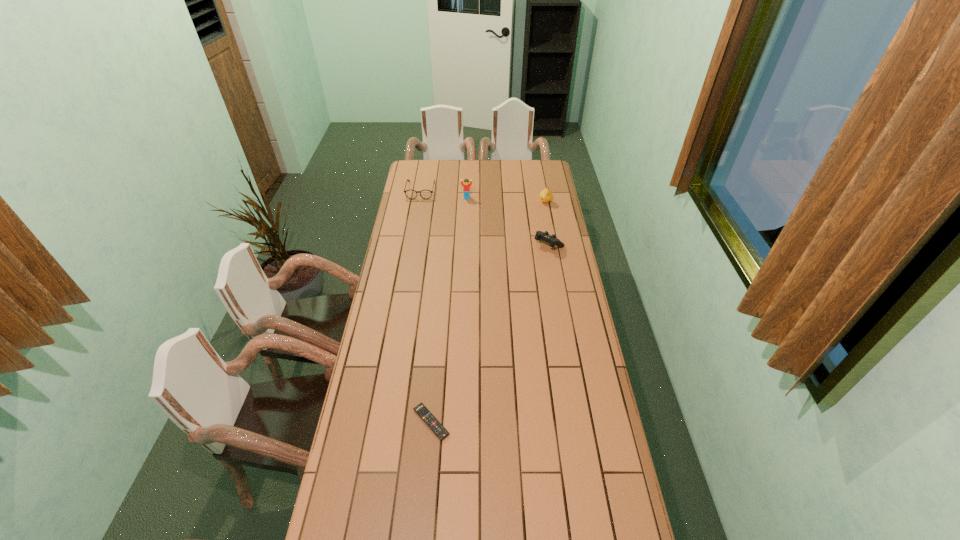
Locate an element on the screen. Lego is located at coordinates (466, 185).

Where is `pear`? pear is located at coordinates (546, 195).

I want to click on control, so click(x=552, y=240).

Where is `spectacles`? spectacles is located at coordinates click(411, 194).

Image resolution: width=960 pixels, height=540 pixels. Identify the location of the nearest object. (439, 430).

At what (x,y) coordinates should I click in order to perform the action: click on the shortest object. Please return your answer as a coordinate pair (x, y). This screenshot has width=960, height=540. Looking at the image, I should click on (439, 430).

Find the location of a particular element. Image resolution: width=960 pixels, height=540 pixels. vacant point located 0.180m on the face of the tallest object is located at coordinates tap(466, 219).

You are a GUI agent. You are given a task and a screenshot of the screen. Output one action in this format:
    pyautogui.click(x=<x>, y=<y>)
    Task: Click on the free space located on the left of the pear
    The height and width of the screenshot is (540, 960).
    Given the screenshot: What is the action you would take?
    pyautogui.click(x=473, y=202)

Find the location of a particular element. The height and width of the screenshot is (540, 960). free space located on the front of the control is located at coordinates (559, 302).

Where is `free region located 0.160m on the front-facing side of the spectacles`? free region located 0.160m on the front-facing side of the spectacles is located at coordinates (416, 217).